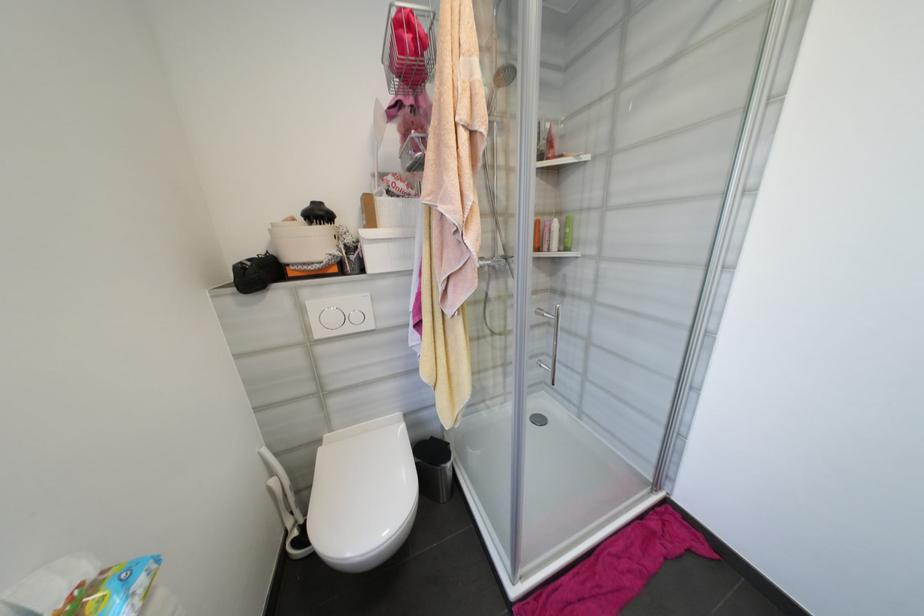
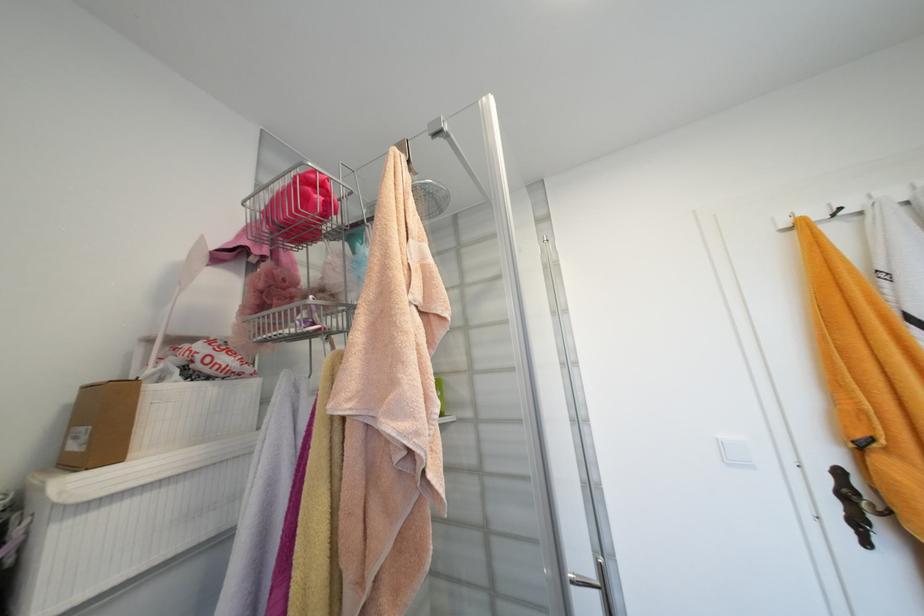
Locate, in the second image, the point that corresponds to (419,124) in the first image.

(289, 282)